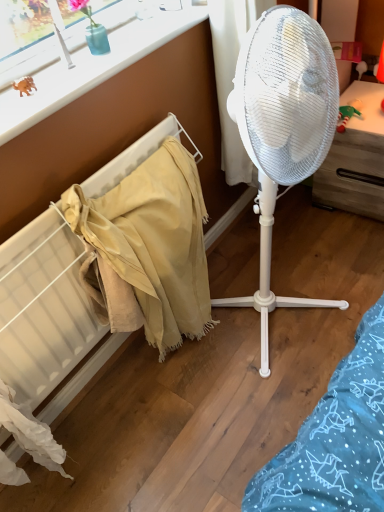
Identify the location of vacant area that is in front of rubber orange dinosaur at upper left. This screenshot has width=384, height=512. (25, 111).